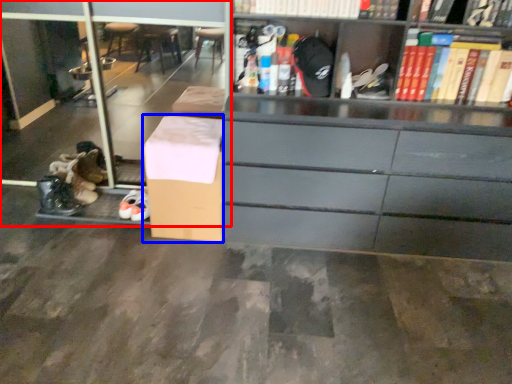
Question: Which object is closer to the camera taking this photo, shelf (highlighted by a red box) or cardboard box (highlighted by a blue box)?

Choices:
 (A) shelf
 (B) cardboard box

Answer: (B)